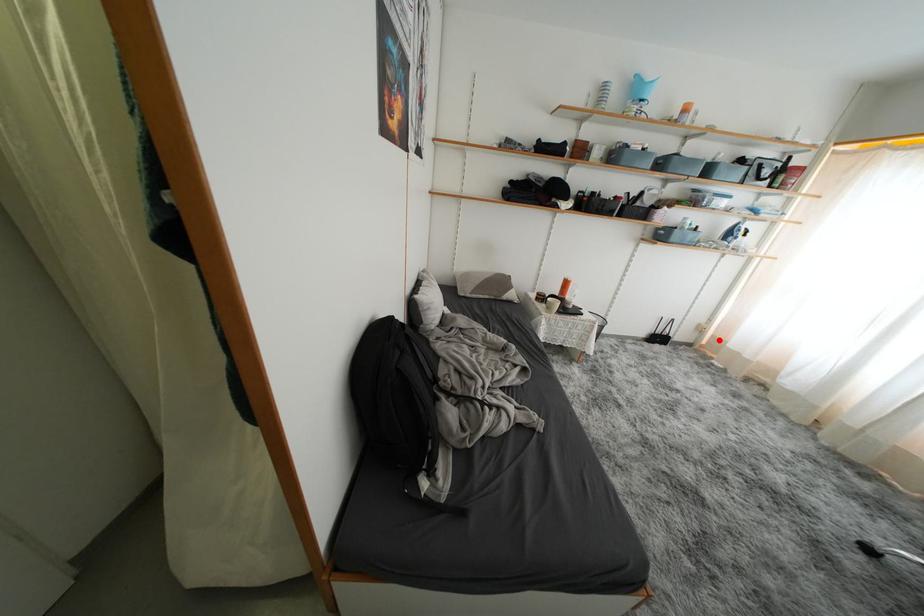
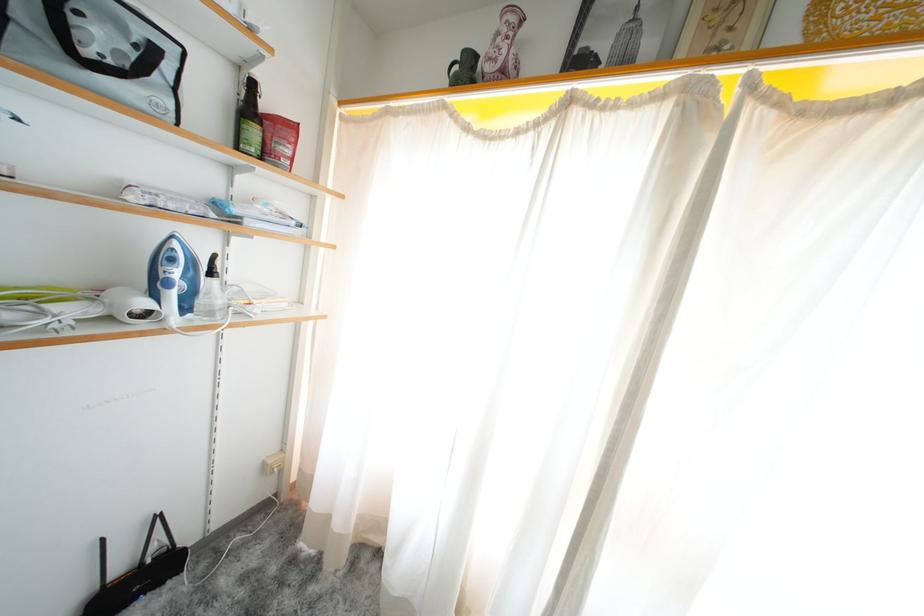
Where in the second image is the point corresponding to the highlighted location from the first image?

(306, 475)